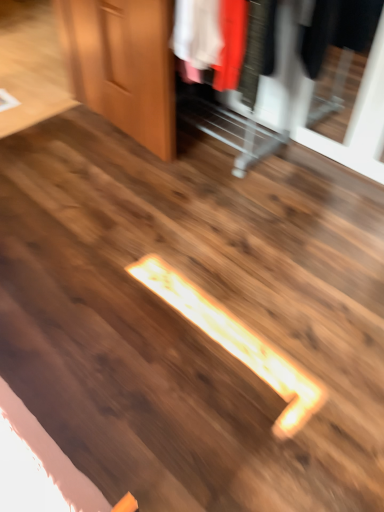
Find the location of `wooden door at upper left`. wooden door at upper left is located at coordinates (123, 65).

What do you see at coordinates (123, 65) in the screenshot?
I see `wooden door at upper left` at bounding box center [123, 65].

Image resolution: width=384 pixels, height=512 pixels. Describe the element at coordinates (122, 65) in the screenshot. I see `wooden dresser at upper right` at that location.

In order to face wooden dresser at upper right, should I rotate leftwards or rightwards?

Rotate right and turn 2.121 degrees.

Where is `wooden dresser at upper right`? wooden dresser at upper right is located at coordinates (122, 65).

You are a GUI agent. You are given a task and a screenshot of the screen. Output one action in this format:
    pyautogui.click(x=<x>, y=<y>)
    Task: Click on the wooden door at upper left
    
    Given the screenshot: What is the action you would take?
    point(123,65)

Considering the positions of objects wooden dresser at upper right and wooden door at upper left in the image provided, who is more to the right, wooden dresser at upper right or wooden door at upper left?

Positioned to the right is wooden dresser at upper right.

Is the position of wooden dresser at upper right more distant than that of wooden door at upper left?

No, it is not.

Considering the points (134, 129) and (118, 62), which point is behind, point (134, 129) or point (118, 62)?

The point (134, 129) is farther from the camera.

From the image's perspective, is wooden dresser at upper right on wooden door at upper left?

No, from the image's perspective, wooden dresser at upper right is not on top of wooden door at upper left.

From a real-world perspective, is wooden dresser at upper right beneath wooden door at upper left?

No, from a real-world perspective, wooden dresser at upper right is not beneath wooden door at upper left.

Can you confirm if wooden dresser at upper right is thinner than wooden door at upper left?

No.

Is wooden dresser at upper right taller than wooden door at upper left?

Yes.

Considering the relative sizes of wooden dresser at upper right and wooden door at upper left in the image provided, is wooden dresser at upper right bigger than wooden door at upper left?

Correct, wooden dresser at upper right is larger in size than wooden door at upper left.

From the picture: Which is correct: wooden dresser at upper right is inside wooden door at upper left, or outside of it?

wooden dresser at upper right is located beyond the bounds of wooden door at upper left.

Would you say wooden dresser at upper right is a long distance from wooden door at upper left?

That's not correct — wooden dresser at upper right is a little close to wooden door at upper left.

Is wooden dresser at upper right positioned with its back to wooden door at upper left?

wooden dresser at upper right does not have its back to wooden door at upper left.

What's the angular difference between wooden dresser at upper right and wooden door at upper left's facing directions?

1.4 degrees separate the facing orientations of wooden dresser at upper right and wooden door at upper left.

What are the coordinates of `door behind the wooden dresser at upper right` in the screenshot? It's located at (123, 65).

Between wooden door at upper left and wooden dresser at upper right, which one appears on the left side from the viewer's perspective?

wooden door at upper left is more to the left.

Which is behind, wooden door at upper left or wooden dresser at upper right?

wooden door at upper left is more distant.

Which is more distant, (154, 145) or (141, 4)?

Point (154, 145)

From the image's perspective, is wooden door at upper left located above or below wooden dresser at upper right?

From the image's perspective, wooden door at upper left appears above wooden dresser at upper right.

From a real-world perspective, relative to wooden dresser at upper right, is wooden door at upper left vertically above or below?

In terms of real-world spatial position, wooden door at upper left is below wooden dresser at upper right.

In the scene shown: Is wooden door at upper left thinner than wooden dresser at upper right?

Yes.

Considering the sizes of wooden door at upper left and wooden dresser at upper right in the image, is wooden door at upper left taller or shorter than wooden dresser at upper right?

In the image, wooden door at upper left appears to be shorter than wooden dresser at upper right.

Between wooden door at upper left and wooden dresser at upper right, which one has larger size?

wooden dresser at upper right is bigger.

Is wooden door at upper left inside the boundaries of wooden dresser at upper right, or outside?

wooden door at upper left lies outside wooden dresser at upper right.

Is there a large distance between wooden door at upper left and wooden dresser at upper right?

Actually, wooden door at upper left and wooden dresser at upper right are a little close together.

Is wooden door at upper left oriented towards wooden dresser at upper right?

No, wooden door at upper left does not turn towards wooden dresser at upper right.

How much distance is there between wooden door at upper left and wooden dresser at upper right?

A distance of 0.56 inches exists between wooden door at upper left and wooden dresser at upper right.

Identify the location of dresser above the wooden door at upper left (from a real-world perspective). (122, 65).

Identify the location of door directly beneath the wooden dresser at upper right (from a real-world perspective). This screenshot has height=512, width=384. (123, 65).

Find the location of `door above the wooden dresser at upper right (from the image's perspective)`. door above the wooden dresser at upper right (from the image's perspective) is located at coordinates (123, 65).